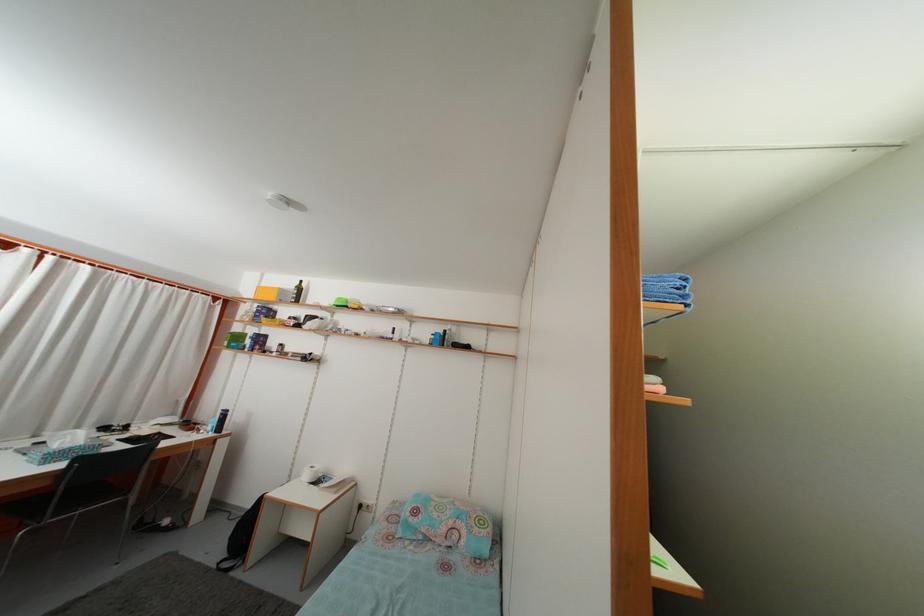
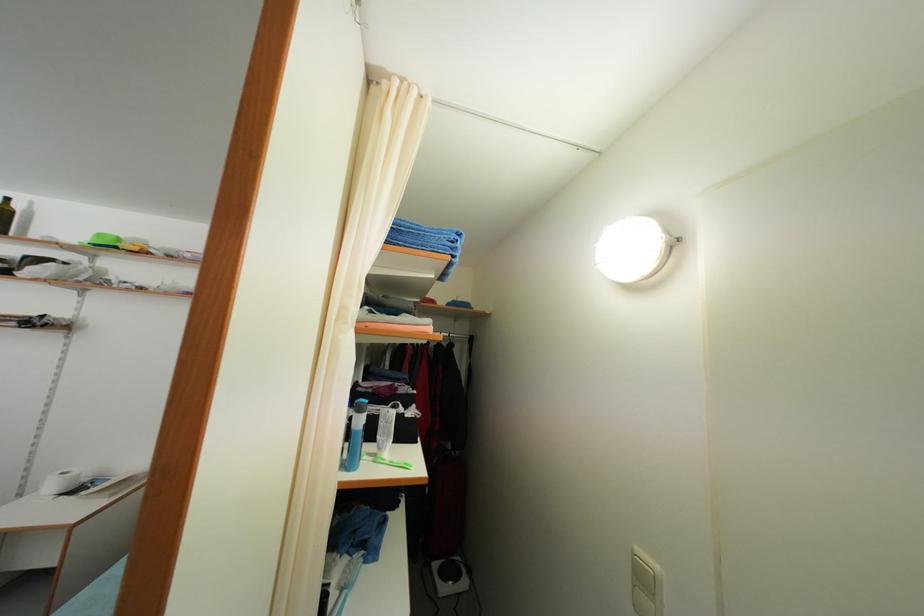
The point at (344,307) is marked in the first image. Where is the corresponding point in the second image?

(104, 243)